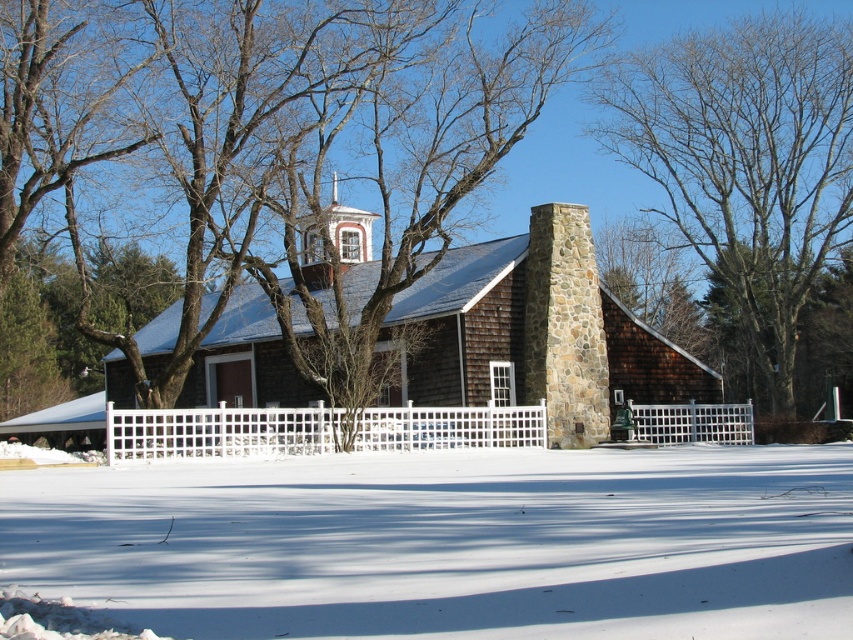
Does white powdery snow at lower center have a lesser width compared to bare branches at center?

Incorrect, white powdery snow at lower center's width is not less than bare branches at center's.

Does white powdery snow at lower center appear on the right side of bare branches at center?

No, white powdery snow at lower center is not to the right of bare branches at center.

Image resolution: width=853 pixels, height=640 pixels. I want to click on white powdery snow at lower center, so click(x=450, y=544).

Identify the location of white powdery snow at lower center. (450, 544).

Who is lower down, brown wooden church at center or bare branches at center?

brown wooden church at center is lower down.

Is brown wooden church at center taller than bare branches at center?

No.

This screenshot has height=640, width=853. What are the coordinates of `brown wooden church at center` in the screenshot? It's located at (544, 339).

Does white powdery snow at lower center have a greater width compared to brown wooden church at center?

Incorrect, white powdery snow at lower center's width does not surpass brown wooden church at center's.

At what (x,y) coordinates should I click in order to perform the action: click on white powdery snow at lower center. Please return your answer as a coordinate pair (x, y). Looking at the image, I should click on (450, 544).

The height and width of the screenshot is (640, 853). I want to click on white powdery snow at lower center, so [x=450, y=544].

At what (x,y) coordinates should I click in order to perform the action: click on white powdery snow at lower center. Please return your answer as a coordinate pair (x, y). This screenshot has height=640, width=853. Looking at the image, I should click on (450, 544).